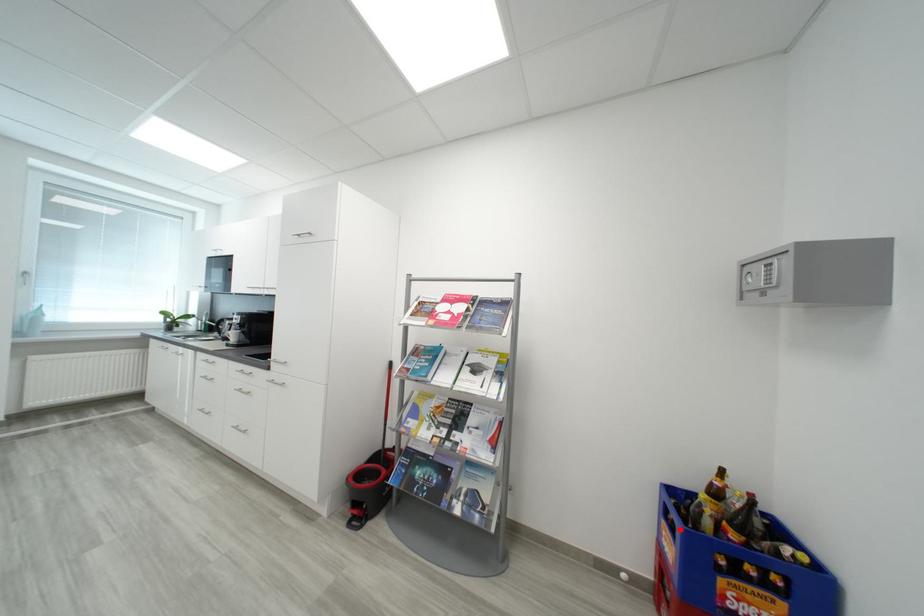
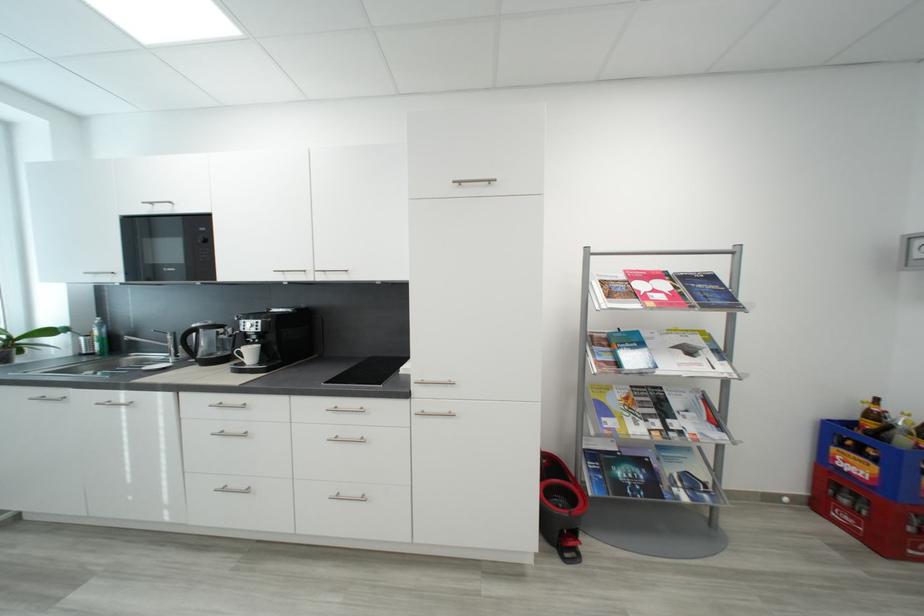
Question: A red point is marked in image1. In image2, is the corresponding 3D point closer to the camera or farther? Reply with the corresponding letter.

Choices:
 (A) The corresponding 3D point is closer.
 (B) The corresponding 3D point is farther.

Answer: (A)